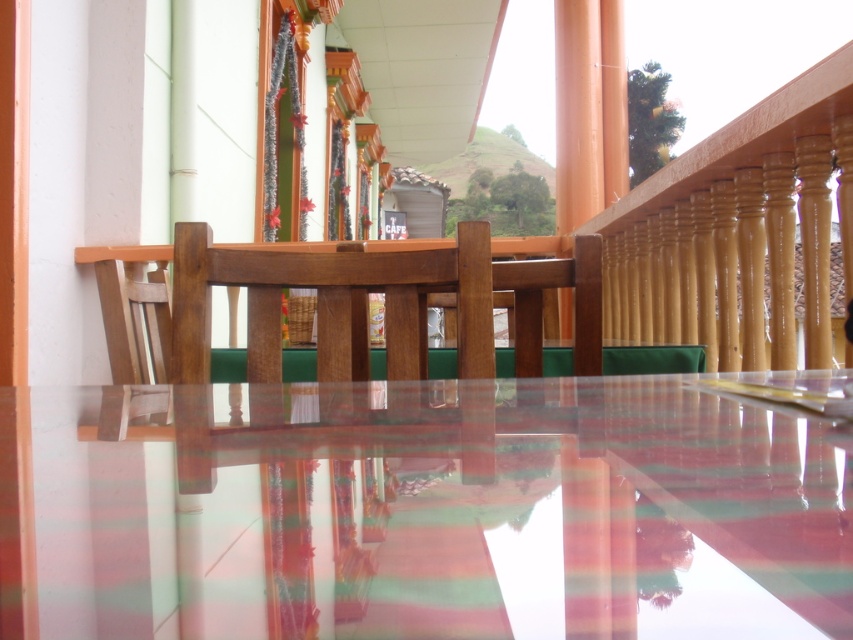
Question: Which object is closer to the camera taking this photo?

Choices:
 (A) wooden chair at center
 (B) transparent glossy glass table at center

Answer: (B)

Question: Can you confirm if transparent glossy glass table at center is bigger than wooden chair at center?

Choices:
 (A) no
 (B) yes

Answer: (A)

Question: Among these objects, which one is nearest to the camera?

Choices:
 (A) wooden chair at center
 (B) transparent glossy glass table at center

Answer: (B)

Question: Does transparent glossy glass table at center appear under wooden chair at center?

Choices:
 (A) no
 (B) yes

Answer: (B)

Question: Does transparent glossy glass table at center lie in front of wooden chair at center?

Choices:
 (A) no
 (B) yes

Answer: (B)